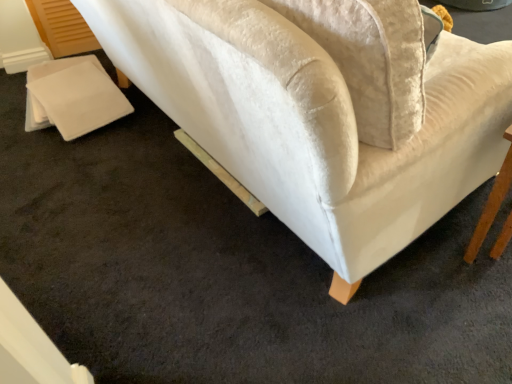
I want to click on wooden table at lower right, so click(x=492, y=203).

The height and width of the screenshot is (384, 512). What do you see at coordinates (492, 203) in the screenshot?
I see `wooden table at lower right` at bounding box center [492, 203].

The image size is (512, 384). Identify the location of velvet white couch at upper right. (315, 125).

This screenshot has width=512, height=384. What do you see at coordinates (315, 125) in the screenshot?
I see `velvet white couch at upper right` at bounding box center [315, 125].

In order to click on wooden table at lower right in this screenshot , I will do `click(492, 203)`.

Visually, is wooden table at lower right positioned to the left or to the right of velvet white couch at upper right?

wooden table at lower right is to the right of velvet white couch at upper right.

Is the position of wooden table at lower right more distant than that of velvet white couch at upper right?

Yes, the depth of wooden table at lower right is greater than that of velvet white couch at upper right.

Is point (464, 255) closer to camera compared to point (282, 191)?

No, (464, 255) is further to viewer.

From the image's perspective, does wooden table at lower right appear lower than velvet white couch at upper right?

Correct, wooden table at lower right appears lower than velvet white couch at upper right in the image.

Based on the photo, from a real-world perspective, is wooden table at lower right positioned over velvet white couch at upper right based on gravity?

Correct, in the physical world, wooden table at lower right is higher than velvet white couch at upper right.

Can you confirm if wooden table at lower right is wider than velvet white couch at upper right?

No, wooden table at lower right is not wider than velvet white couch at upper right.

Who is shorter, wooden table at lower right or velvet white couch at upper right?

velvet white couch at upper right is shorter.

Between wooden table at lower right and velvet white couch at upper right, which one has smaller size?

Smaller between the two is wooden table at lower right.

Is wooden table at lower right completely or partially outside of velvet white couch at upper right?

Indeed, wooden table at lower right is completely outside velvet white couch at upper right.

Is wooden table at lower right far away from velvet white couch at upper right?

No.

Is wooden table at lower right oriented away from velvet white couch at upper right?

wooden table at lower right is not turned away from velvet white couch at upper right.

Measure the distance between wooden table at lower right and velvet white couch at upper right.

The distance of wooden table at lower right from velvet white couch at upper right is 17.46 inches.

Image resolution: width=512 pixels, height=384 pixels. I want to click on studio couch that appears above the wooden table at lower right (from the image's perspective), so click(x=315, y=125).

Which object is positioned more to the left, velvet white couch at upper right or wooden table at lower right?

velvet white couch at upper right is more to the left.

Does velvet white couch at upper right lie in front of wooden table at lower right?

Yes, the depth of velvet white couch at upper right is less than that of wooden table at lower right.

Is point (440, 85) more distant than point (492, 190)?

No.

Consider the image. From the image's perspective, is velvet white couch at upper right positioned above or below wooden table at lower right?

Clearly, from the image's perspective, velvet white couch at upper right is above wooden table at lower right.

From a real-world perspective, between velvet white couch at upper right and wooden table at lower right, who is vertically lower?

velvet white couch at upper right.

Looking at their sizes, would you say velvet white couch at upper right is wider or thinner than wooden table at lower right?

Clearly, velvet white couch at upper right has more width compared to wooden table at lower right.

Does velvet white couch at upper right have a lesser height compared to wooden table at lower right?

Indeed, velvet white couch at upper right has a lesser height compared to wooden table at lower right.

Based on their sizes in the image, would you say velvet white couch at upper right is bigger or smaller than wooden table at lower right?

Clearly, velvet white couch at upper right is larger in size than wooden table at lower right.

Does velvet white couch at upper right contain wooden table at lower right?

No, wooden table at lower right is not a part of velvet white couch at upper right.

Is velvet white couch at upper right far from wooden table at lower right?

No, velvet white couch at upper right is not far from wooden table at lower right.

Is velvet white couch at upper right turned away from wooden table at lower right?

velvet white couch at upper right is not turned away from wooden table at lower right.

Find the location of `studio couch lying above the wooden table at lower right (from the image's perspective)`. studio couch lying above the wooden table at lower right (from the image's perspective) is located at coordinates (315, 125).

Where is `table located behind the velvet white couch at upper right`? This screenshot has width=512, height=384. table located behind the velvet white couch at upper right is located at coordinates (492, 203).

You are a GUI agent. You are given a task and a screenshot of the screen. Output one action in this format:
    pyautogui.click(x=<x>, y=<y>)
    Task: Click on the studio couch above the wooden table at lower right (from the image's perspective)
    This screenshot has height=384, width=512.
    Given the screenshot: What is the action you would take?
    pyautogui.click(x=315, y=125)